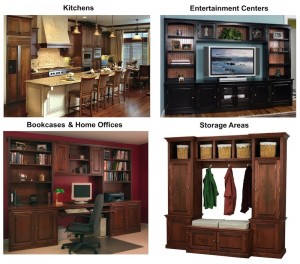
The height and width of the screenshot is (264, 300). Identify the location of cabinet doors. (266, 197), (181, 189), (204, 240), (229, 242).